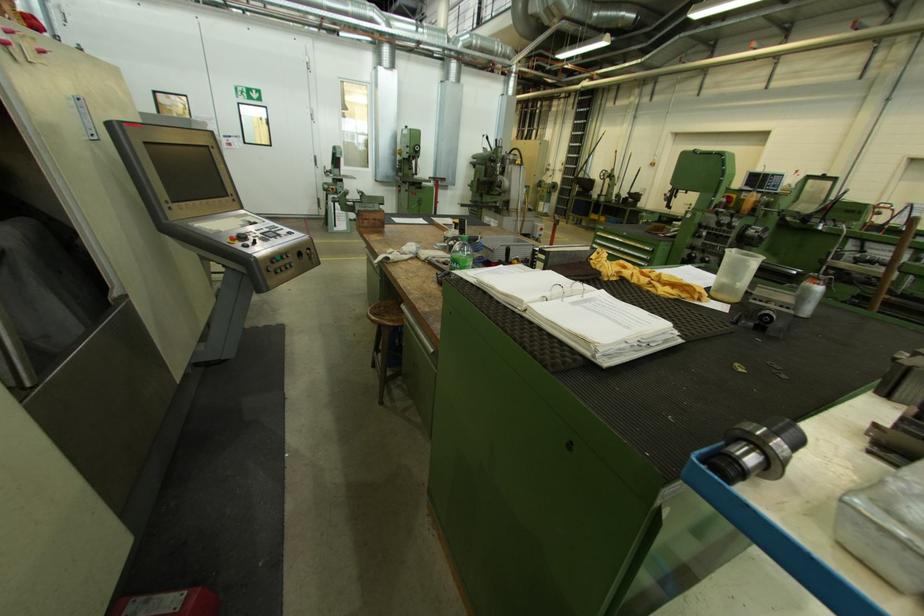
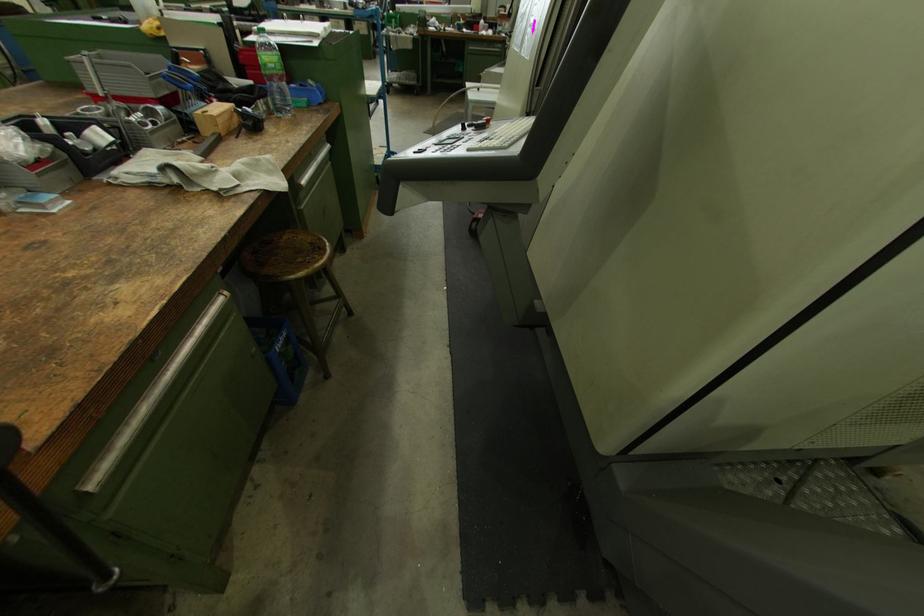
Locate, in the second image, the point that corresponds to [390,317] in the first image.

(317, 244)